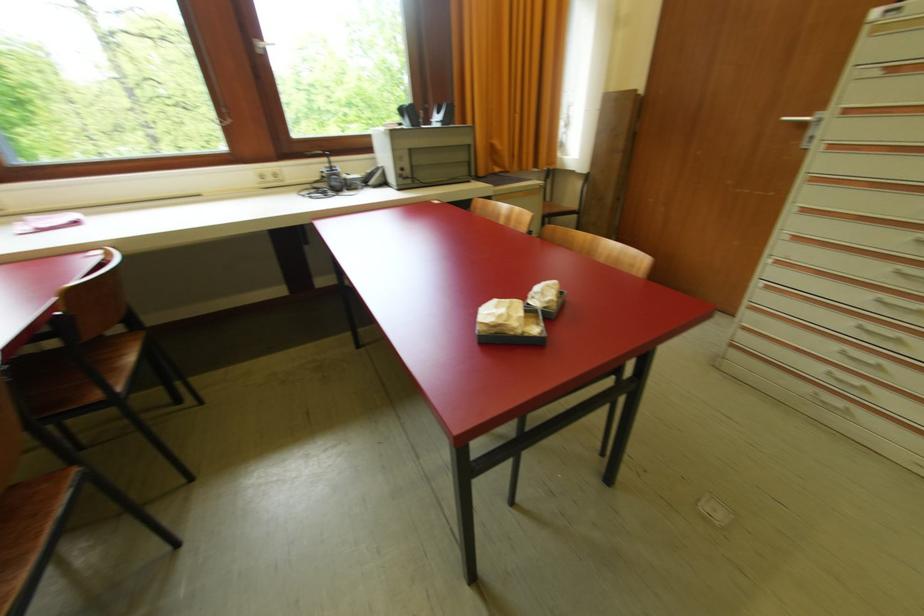
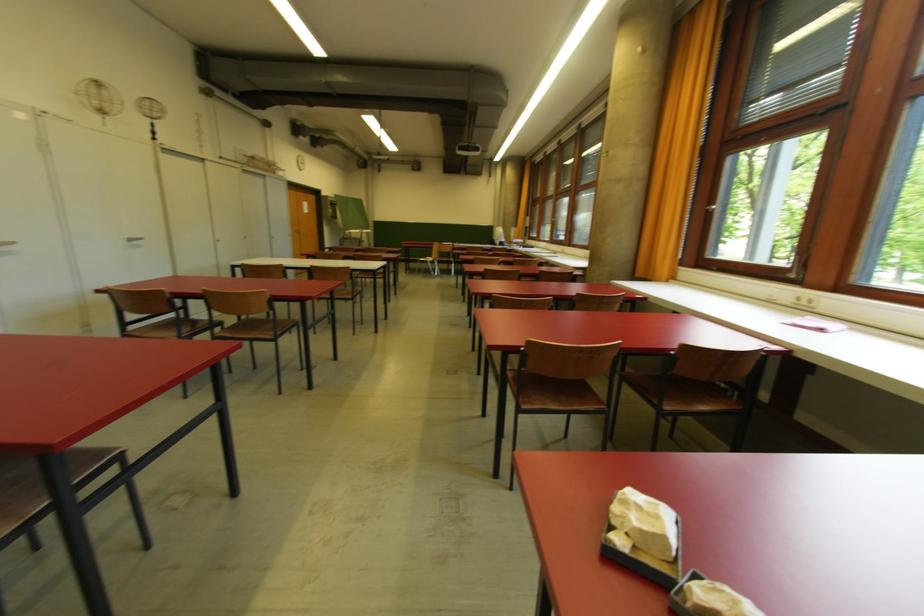
Locate, in the second image, the point that corresponds to pixel 523 318 in the first image.

(633, 522)